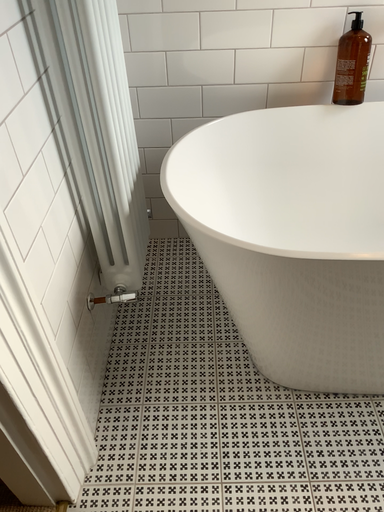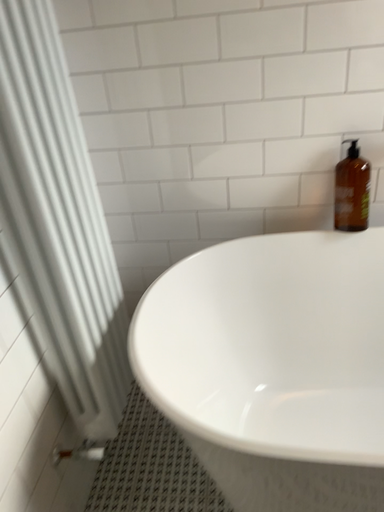
Question: How did the camera likely rotate when shooting the video?

Choices:
 (A) rotated downward
 (B) rotated upward

Answer: (B)